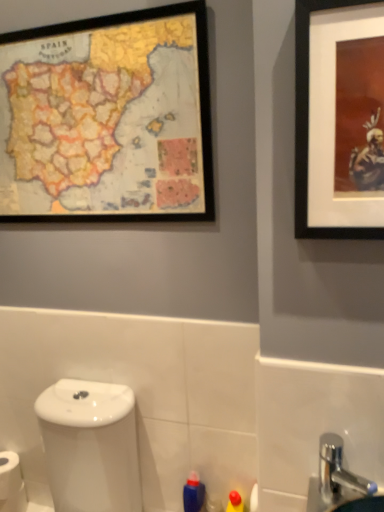
Question: Is wooden map at upper left, acting as the first picture frame starting from the back, not within silver metallic faucet at lower right?

Choices:
 (A) yes
 (B) no

Answer: (A)

Question: Considering the relative sizes of wooden map at upper left, acting as the 1th picture frame starting from the left, and silver metallic faucet at lower right in the image provided, is wooden map at upper left, acting as the 1th picture frame starting from the left, bigger than silver metallic faucet at lower right?

Choices:
 (A) yes
 (B) no

Answer: (A)

Question: Could silver metallic faucet at lower right be considered to be inside wooden map at upper left, acting as the first picture frame starting from the back?

Choices:
 (A) yes
 (B) no

Answer: (B)

Question: Is wooden map at upper left, which is counted as the 2th picture frame, starting from the front, in contact with silver metallic faucet at lower right?

Choices:
 (A) no
 (B) yes

Answer: (A)

Question: Can you confirm if wooden map at upper left, acting as the first picture frame starting from the back, is positioned to the left of silver metallic faucet at lower right?

Choices:
 (A) no
 (B) yes

Answer: (B)

Question: Relative to blue plastic bottle at lower center, is white matte toilet paper at lower left in front or behind?

Choices:
 (A) behind
 (B) front

Answer: (A)

Question: From a real-world perspective, is white matte toilet paper at lower left physically located above or below blue plastic bottle at lower center?

Choices:
 (A) above
 (B) below

Answer: (A)

Question: In terms of width, does white matte toilet paper at lower left look wider or thinner when compared to blue plastic bottle at lower center?

Choices:
 (A) wide
 (B) thin

Answer: (A)

Question: Looking at the image, does white matte toilet paper at lower left seem bigger or smaller compared to blue plastic bottle at lower center?

Choices:
 (A) small
 (B) big

Answer: (A)

Question: Is silver metallic faucet at lower right to the left or to the right of white glossy toilet at lower left in the image?

Choices:
 (A) right
 (B) left

Answer: (A)

Question: Is silver metallic faucet at lower right in front of or behind white glossy toilet at lower left in the image?

Choices:
 (A) front
 (B) behind

Answer: (A)

Question: From the image's perspective, is silver metallic faucet at lower right above or below white glossy toilet at lower left?

Choices:
 (A) below
 (B) above

Answer: (B)

Question: Is silver metallic faucet at lower right taller or shorter than white glossy toilet at lower left?

Choices:
 (A) short
 (B) tall

Answer: (A)

Question: From a real-world perspective, is wooden map at upper left, which is counted as the 2th picture frame, starting from the right, physically located above or below black matte picture frame at upper right, the second picture frame positioned from the back?

Choices:
 (A) above
 (B) below

Answer: (A)

Question: Would you say wooden map at upper left, acting as the 1th picture frame starting from the left, is to the left or to the right of black matte picture frame at upper right, which is the 1th picture frame from right to left, in the picture?

Choices:
 (A) left
 (B) right

Answer: (A)